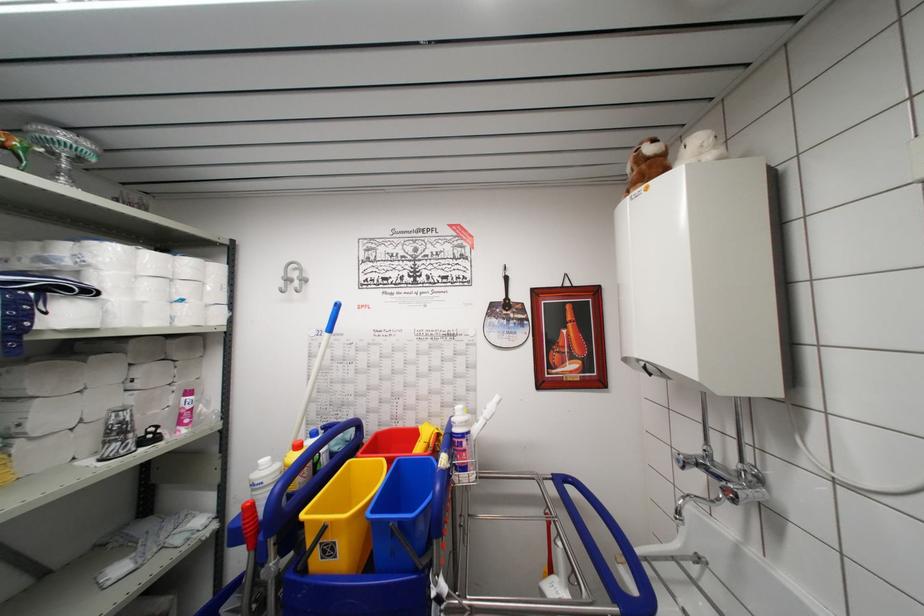
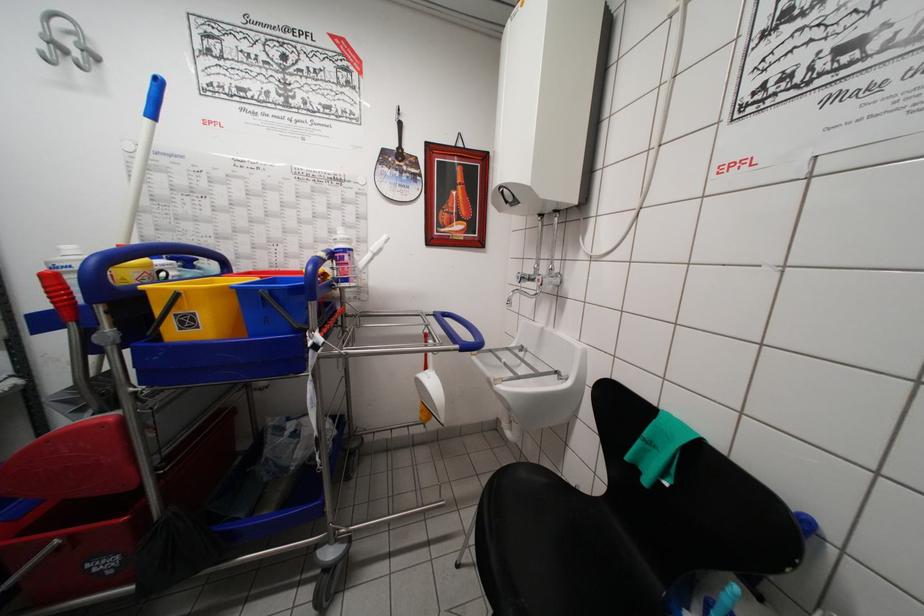
In the second image, find the point that corresponds to (490,418) in the first image.

(377, 253)